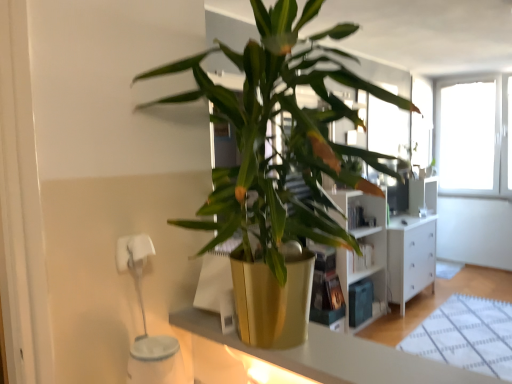
Where is `blank space above metallic gold pot at center (from a real-world perspective)`? blank space above metallic gold pot at center (from a real-world perspective) is located at coordinates (347, 352).